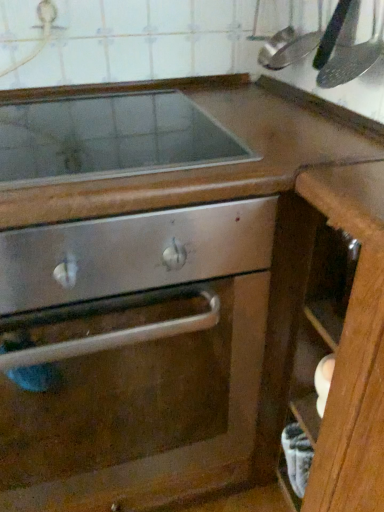
Question: Does stainless steel oven door at center have a lesser height compared to brushed metal faucet at upper left?

Choices:
 (A) no
 (B) yes

Answer: (A)

Question: From the image's perspective, is stainless steel oven door at center located above brushed metal faucet at upper left?

Choices:
 (A) yes
 (B) no

Answer: (B)

Question: Can you confirm if stainless steel oven door at center is taller than brushed metal faucet at upper left?

Choices:
 (A) no
 (B) yes

Answer: (B)

Question: From a real-world perspective, does stainless steel oven door at center sit lower than brushed metal faucet at upper left?

Choices:
 (A) yes
 (B) no

Answer: (A)

Question: From a real-world perspective, does stainless steel oven door at center stand above brushed metal faucet at upper left?

Choices:
 (A) no
 (B) yes

Answer: (A)

Question: Could you tell me if stainless steel oven door at center is facing brushed metal faucet at upper left?

Choices:
 (A) no
 (B) yes

Answer: (A)

Question: Is wooden drawer at lower right next to metallic silver spatula at upper right?

Choices:
 (A) yes
 (B) no

Answer: (B)

Question: Does wooden drawer at lower right contain metallic silver spatula at upper right?

Choices:
 (A) yes
 (B) no

Answer: (B)

Question: From the image's perspective, is wooden drawer at lower right below metallic silver spatula at upper right?

Choices:
 (A) no
 (B) yes

Answer: (B)

Question: Does wooden drawer at lower right have a larger size compared to metallic silver spatula at upper right?

Choices:
 (A) yes
 (B) no

Answer: (A)

Question: Considering the relative sizes of wooden drawer at lower right and metallic silver spatula at upper right in the image provided, is wooden drawer at lower right shorter than metallic silver spatula at upper right?

Choices:
 (A) yes
 (B) no

Answer: (A)

Question: Are wooden drawer at lower right and metallic silver spatula at upper right located far from each other?

Choices:
 (A) yes
 (B) no

Answer: (B)

Question: Considering the relative sizes of metallic silver spatula at upper right and stainless steel oven door at center in the image provided, is metallic silver spatula at upper right shorter than stainless steel oven door at center?

Choices:
 (A) yes
 (B) no

Answer: (A)